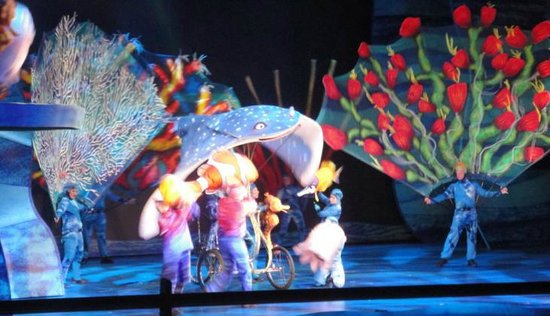
Find the location of `blue floor`. blue floor is located at coordinates (394, 266), (462, 197), (114, 266).